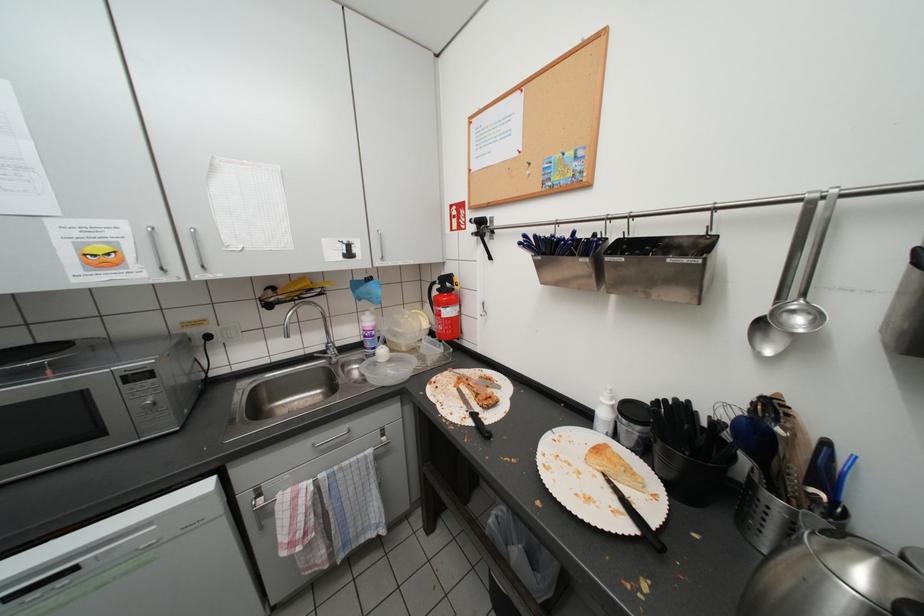
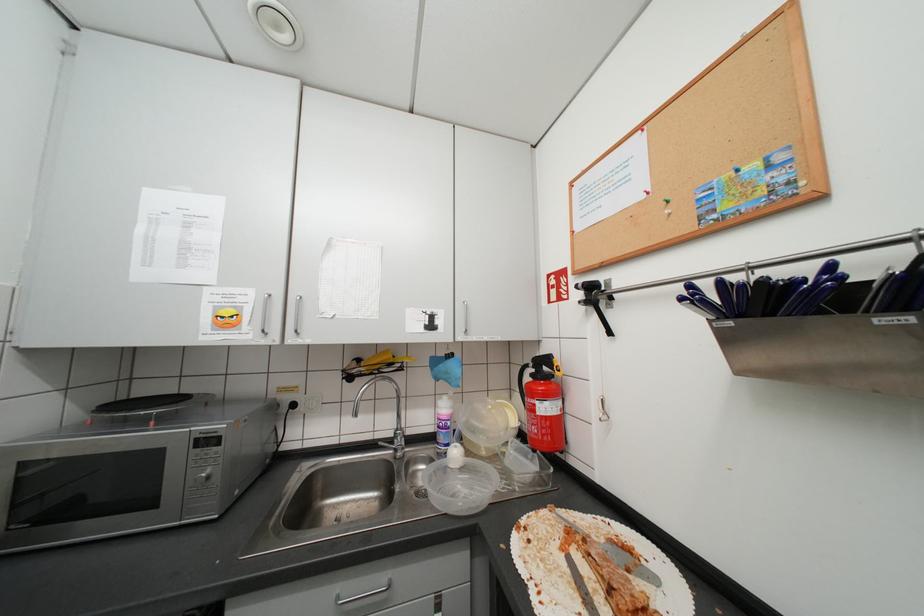
Question: What movement of the cameraman would produce the second image?

Choices:
 (A) Left
 (B) Right
 (C) Forward
 (D) Backward

Answer: (C)